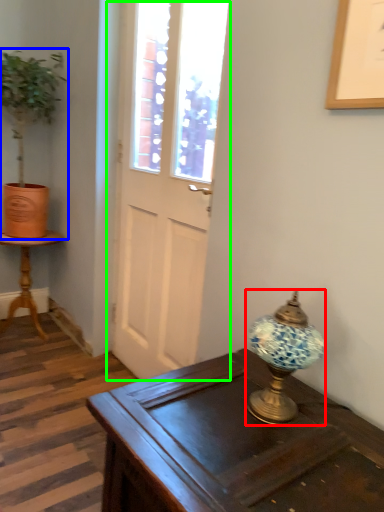
Question: Which object is the farthest from lamp (highlighted by a red box)? Choose among these: houseplant (highlighted by a blue box) or door (highlighted by a green box).

Choices:
 (A) houseplant
 (B) door

Answer: (A)